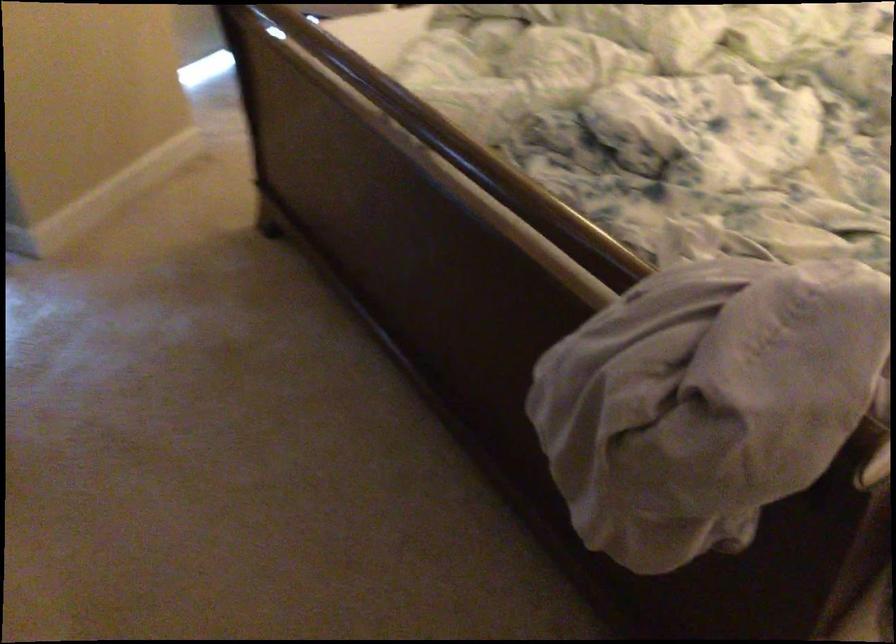
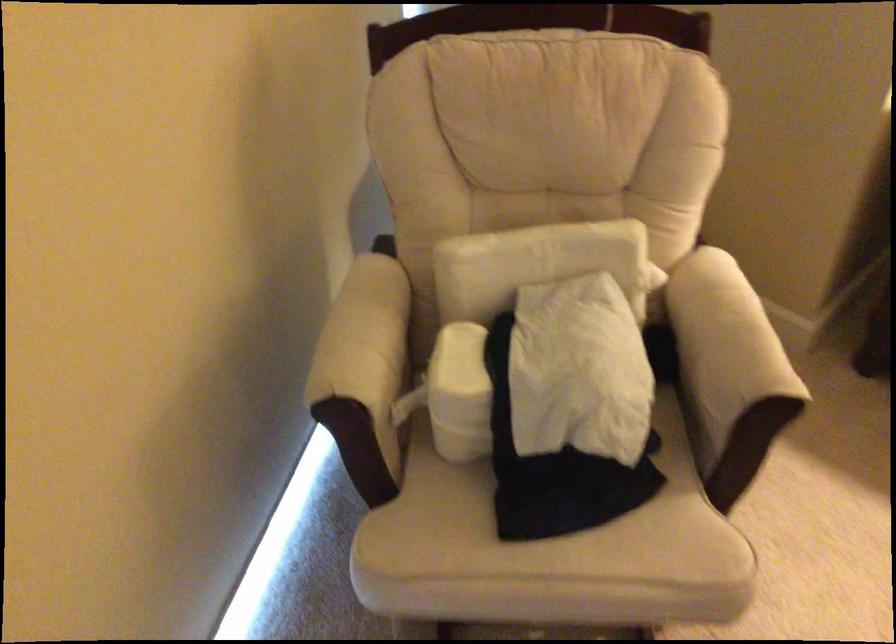
What movement of the cameraman would produce the second image?

The cameraman moved toward left, forward.